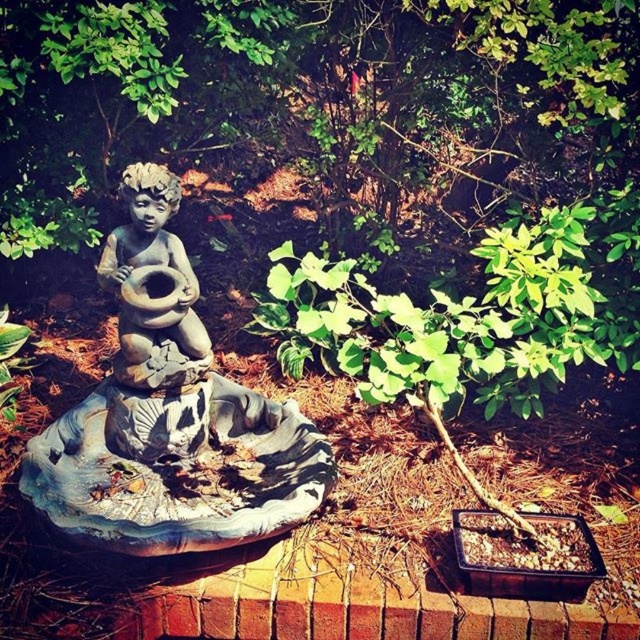
In the scene shown: You are a gardener assessing the garden layout. You need to determine if the green leafy tree at upper center will block sunlight from reaching the gray stone cherub at center. Based on their heights, can you conclude this?

The green leafy tree at upper center is not as tall as the gray stone cherub at center, so it will not block sunlight from reaching the gray stone cherub at center.

You are standing in the garden and see the central stone statue of a cherubic figure seated on a rock. There is a point marked at coordinates [276,74]. What is located at that point?

The point at coordinates [276,74] corresponds to a green leafy tree at upper center.

You are standing in the garden and want to approach the statue. If you move forward 5 feet, will you be closer to the point at coordinates (429,52) than 8.39 feet?

Yes, because moving forward 5 feet reduces the distance from 8.39 feet to 3.39 feet, which is closer than 8.39 feet.